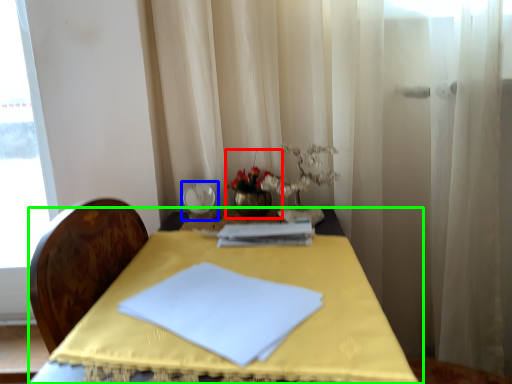
Question: Considering the real-world distances, which object is closest to floral arrangement (highlighted by a red box)? tableware (highlighted by a blue box) or table (highlighted by a green box).

Choices:
 (A) tableware
 (B) table

Answer: (A)